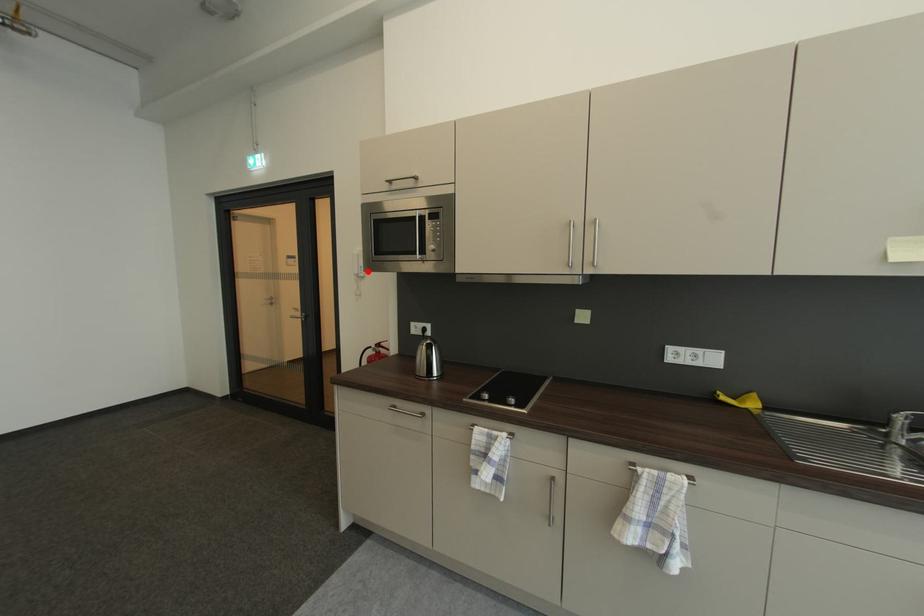
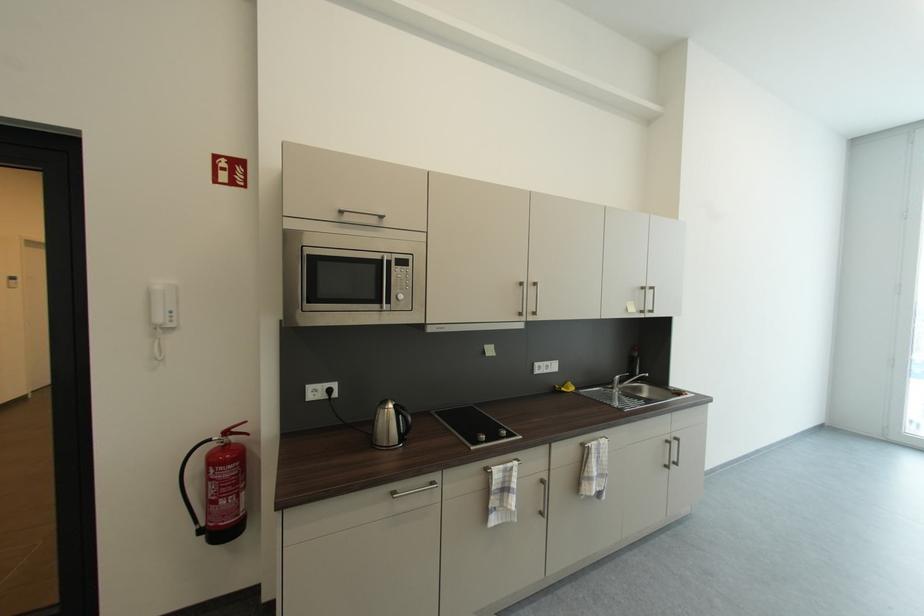
The point at the highlighted location is marked in the first image. Where is the corresponding point in the second image?

(177, 318)